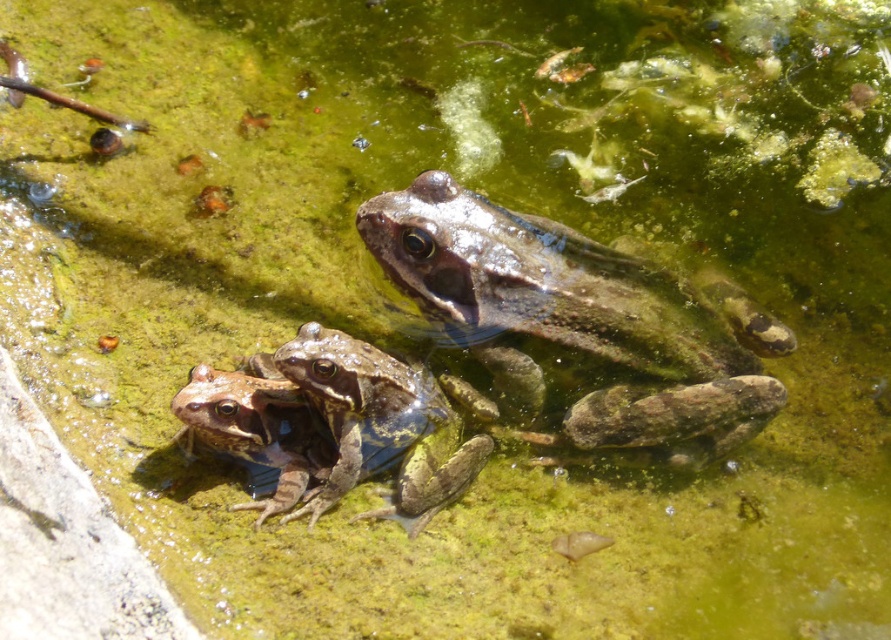
Question: From the image, what is the correct spatial relationship of camouflage skin frog at center in relation to camouflage-patterned frog at center?

Choices:
 (A) below
 (B) above

Answer: (B)

Question: Does camouflage skin frog at center appear under camouflage-patterned frog at center?

Choices:
 (A) yes
 (B) no

Answer: (B)

Question: Which point is farther to the camera?

Choices:
 (A) camouflage skin frog at center
 (B) camouflage-patterned frog at center

Answer: (A)

Question: Considering the relative positions of camouflage skin frog at center and camouflage-patterned frog at center in the image provided, where is camouflage skin frog at center located with respect to camouflage-patterned frog at center?

Choices:
 (A) above
 (B) below

Answer: (A)

Question: Among these points, which one is farthest from the camera?

Choices:
 (A) (349, 369)
 (B) (535, 442)

Answer: (B)